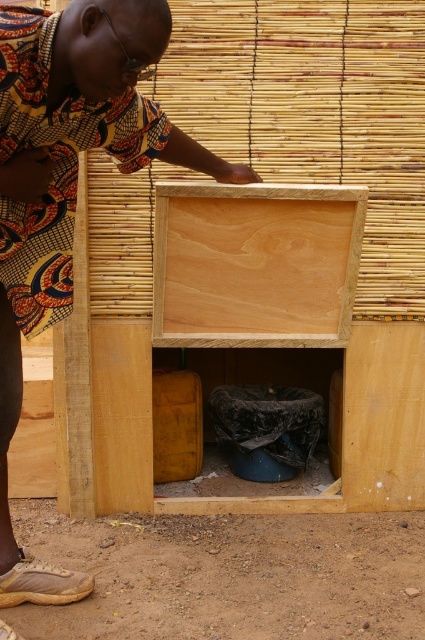
Question: Does printed fabric shirt at center appear on the right side of natural wood crate at center?

Choices:
 (A) yes
 (B) no

Answer: (B)

Question: Which point is closer to the camera?

Choices:
 (A) click(308, 234)
 (B) click(147, 124)

Answer: (B)

Question: Is printed fabric shirt at center to the left of natural wood crate at center from the viewer's perspective?

Choices:
 (A) yes
 (B) no

Answer: (A)

Question: Among these points, which one is nearest to the camera?

Choices:
 (A) (246, 218)
 (B) (54, 100)

Answer: (B)

Question: Does printed fabric shirt at center have a larger size compared to natural wood crate at center?

Choices:
 (A) yes
 (B) no

Answer: (A)